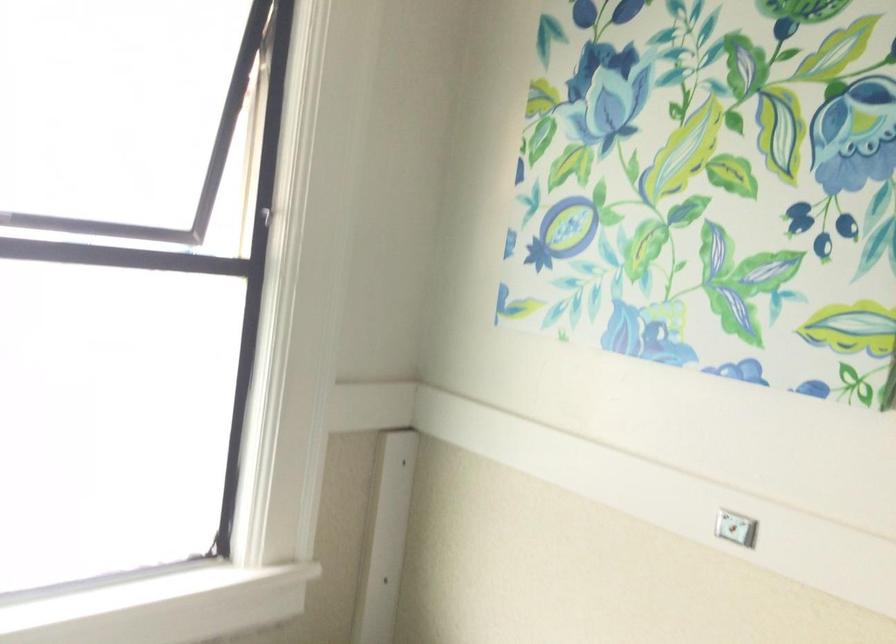
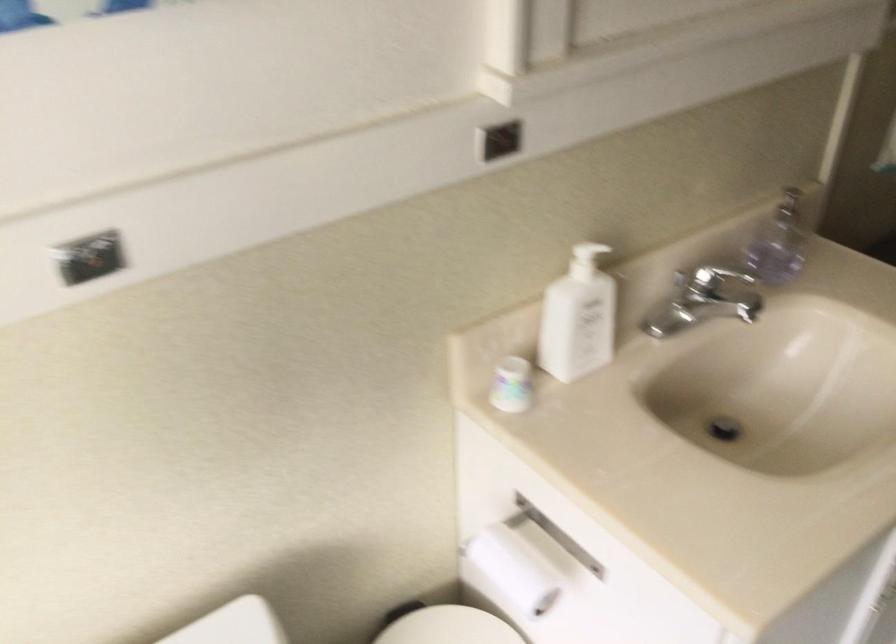
The first image is from the beginning of the video and the second image is from the end. How did the camera likely rotate when shooting the video?

The camera's rotation is toward right-down.